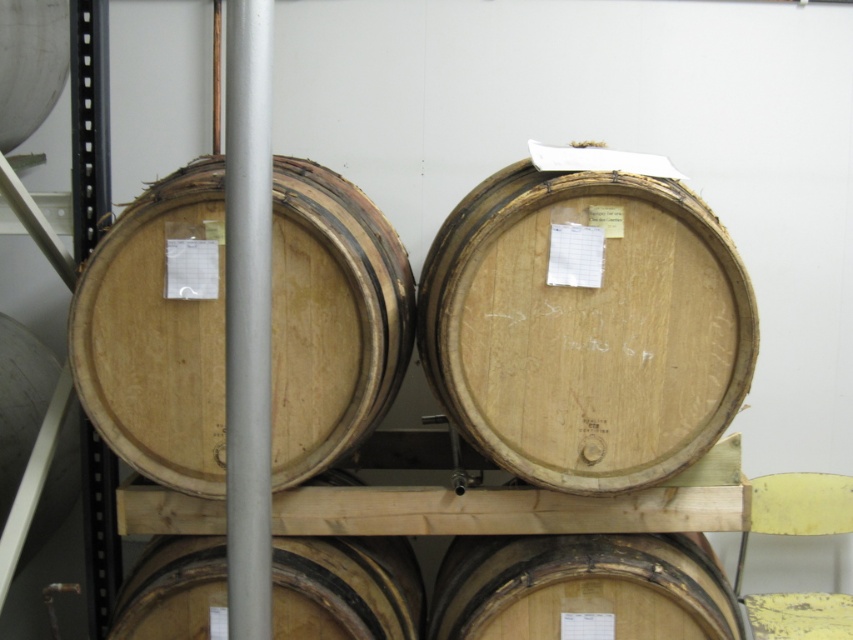
You are standing in the storage area looking at the wooden barrels. There is a point marked at coordinates (158,332). Which barrel does this point correspond to?

The point at coordinates (158,332) corresponds to the natural wood barrel at left.

You are a warehouse worker who needs to fit a new wooden barrel into the storage area. You have two existing barrels to consider for spacing. The natural wood barrel at left and the natural wood barrel at lower center. Which barrel requires more space horizontally to accommodate its width?

The natural wood barrel at lower center requires more space horizontally because its width is greater than the natural wood barrel at left.